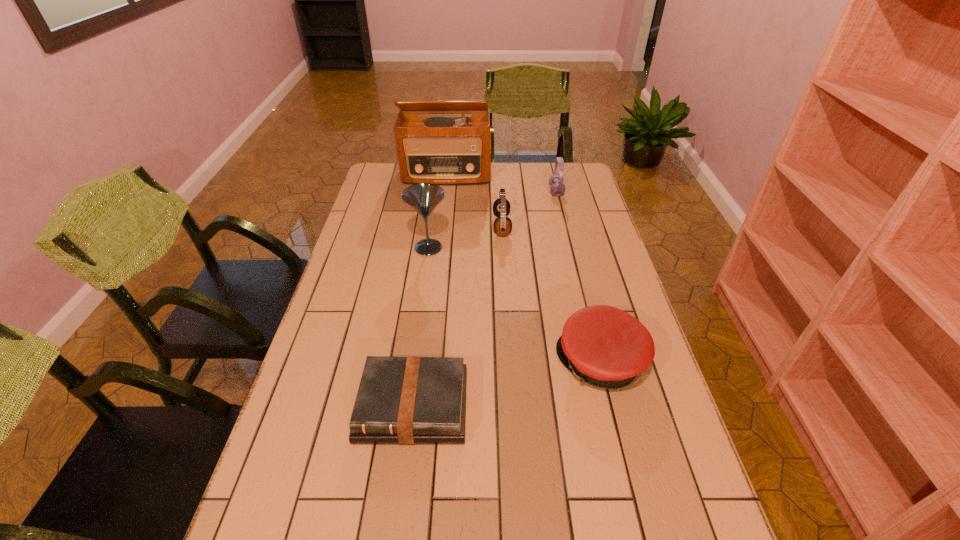
Locate an element on the screen. unoccupied position between the farther headset and the nearer headset is located at coordinates (529, 209).

Locate an element on the screen. The image size is (960, 540). vacant region between the radio receiver and the farther headset is located at coordinates (501, 183).

Locate an element on the screen. This screenshot has height=540, width=960. blank region between the cap and the fifth shortest object is located at coordinates (515, 305).

The width and height of the screenshot is (960, 540). What are the coordinates of `vacant area that lies between the martini and the second shortest object` in the screenshot? It's located at click(x=515, y=305).

At what (x,y) coordinates should I click in order to perform the action: click on vacant space that's between the right headset and the martini. Please return your answer as a coordinate pair (x, y). Looking at the image, I should click on (492, 220).

The height and width of the screenshot is (540, 960). Identify the location of the fifth closest object to the left headset. (410, 400).

Select which object is the closest to the second shortest object. Please provide its 2D coordinates. Your answer should be formatted as a tuple, i.e. [(x, y)], where the tuple contains the x and y coordinates of a point satisfying the conditions above.

[(410, 400)]

At what (x,y) coordinates should I click in order to perform the action: click on free spot that satisfies the following two spatial constraints: 1. on the ear cups of the left headset; 2. on the front side of the martini. Please return your answer as a coordinate pair (x, y). Image resolution: width=960 pixels, height=540 pixels. Looking at the image, I should click on (503, 248).